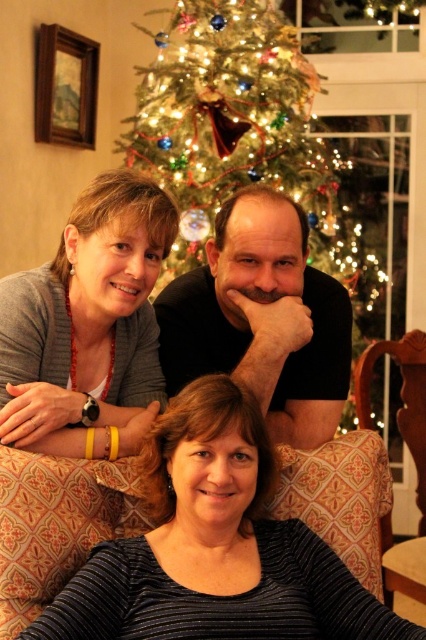
Question: Estimate the real-world distances between objects in this image. Which object is farther from the black matte shirt at center?

Choices:
 (A) black ribbed sweater at lower center
 (B) iridescent glass ornaments at center

Answer: (B)

Question: Which object is the closest to the black ribbed sweater at lower center?

Choices:
 (A) black matte shirt at center
 (B) matte gray sweater at center
 (C) iridescent glass ornaments at center

Answer: (B)

Question: Among these points, which one is nearest to the camera?

Choices:
 (A) (236, 358)
 (B) (278, 72)
 (C) (5, 464)
 (D) (109, 380)

Answer: (C)

Question: Is black ribbed sweater at lower center to the left of matte gray sweater at center from the viewer's perspective?

Choices:
 (A) no
 (B) yes

Answer: (A)

Question: Is black ribbed sweater at lower center smaller than black matte shirt at center?

Choices:
 (A) no
 (B) yes

Answer: (A)

Question: Does matte gray sweater at center appear on the left side of black matte shirt at center?

Choices:
 (A) yes
 (B) no

Answer: (A)